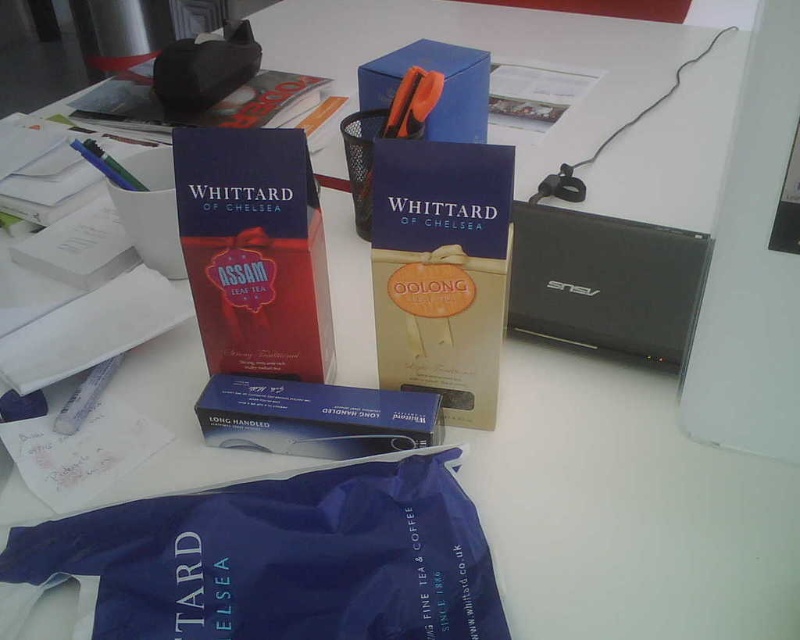
Does point (296, 369) lie in front of point (108, 365)?

Yes, point (296, 369) is in front of point (108, 365).

Where is `matte paper box at center`? The width and height of the screenshot is (800, 640). matte paper box at center is located at coordinates (254, 250).

At what (x,y) coordinates should I click in order to perform the action: click on matte paper box at center. Please return your answer as a coordinate pair (x, y). The width and height of the screenshot is (800, 640). Looking at the image, I should click on (254, 250).

Which of these two, blue fabric bag at lower center or blue cardboard box at upper center, stands taller?

Standing taller between the two is blue cardboard box at upper center.

Between point (100, 532) and point (482, 115), which one is positioned behind?

Point (482, 115)

Image resolution: width=800 pixels, height=640 pixels. Identify the location of blue fabric bag at lower center. (274, 560).

Looking at this image, between black matte book at upper left and matte black tissue box at upper left, which one is positioned lower?

black matte book at upper left is lower down.

Is black matte book at upper left shorter than matte black tissue box at upper left?

Yes.

Which is in front, point (264, 125) or point (182, 51)?

Point (182, 51)

This screenshot has height=640, width=800. In order to click on black matte book at upper left in this screenshot , I will do `click(204, 109)`.